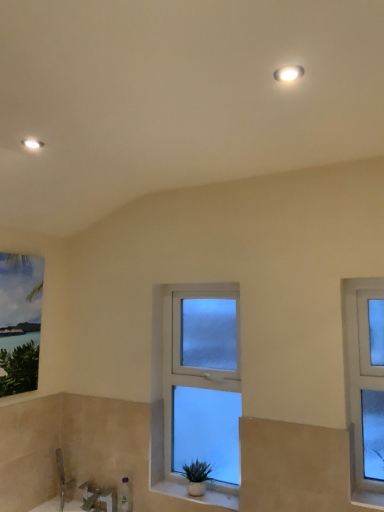
Question: Is matte white recessed light at upper left, which appears as the first light fixture when viewed from the back, looking in the opposite direction of clear glass window at center, arranged as the second window when viewed from the front?

Choices:
 (A) no
 (B) yes

Answer: (A)

Question: Is matte white recessed light at upper left, the 2th light fixture positioned from the top, shorter than clear glass window at center, arranged as the second window when viewed from the front?

Choices:
 (A) yes
 (B) no

Answer: (A)

Question: Is matte white recessed light at upper left, positioned as the second light fixture in right-to-left order, at the left side of clear glass window at center, which is the 1th window in left-to-right order?

Choices:
 (A) no
 (B) yes

Answer: (B)

Question: Is matte white recessed light at upper left, placed as the second light fixture when sorted from front to back, far from clear glass window at center, acting as the first window starting from the back?

Choices:
 (A) yes
 (B) no

Answer: (A)

Question: From the image's perspective, is matte white recessed light at upper left, which is counted as the 1th light fixture, starting from the bottom, beneath clear glass window at center, positioned as the second window in right-to-left order?

Choices:
 (A) no
 (B) yes

Answer: (A)

Question: Can clear glass window at center, arranged as the second window when viewed from the front, be found inside matte white recessed light at upper left, which appears as the first light fixture when viewed from the back?

Choices:
 (A) yes
 (B) no

Answer: (B)

Question: Considering the relative sizes of white glossy light fixture at upper center, the second light fixture when ordered from bottom to top, and matte white recessed light at upper left, arranged as the first light fixture when viewed from the left, in the image provided, is white glossy light fixture at upper center, the second light fixture when ordered from bottom to top, shorter than matte white recessed light at upper left, arranged as the first light fixture when viewed from the left,?

Choices:
 (A) no
 (B) yes

Answer: (B)

Question: Is white glossy light fixture at upper center, the second light fixture when ordered from bottom to top, positioned far away from matte white recessed light at upper left, the 2th light fixture positioned from the top?

Choices:
 (A) yes
 (B) no

Answer: (A)

Question: Is white glossy light fixture at upper center, the 2th light fixture positioned from the left, taller than matte white recessed light at upper left, positioned as the second light fixture in right-to-left order?

Choices:
 (A) no
 (B) yes

Answer: (A)

Question: Is white glossy light fixture at upper center, positioned as the 1th light fixture in top-to-bottom order, further to camera compared to matte white recessed light at upper left, the 2th light fixture positioned from the top?

Choices:
 (A) no
 (B) yes

Answer: (A)

Question: From a real-world perspective, is white glossy light fixture at upper center, the first light fixture when ordered from front to back, beneath matte white recessed light at upper left, the 2th light fixture positioned from the top?

Choices:
 (A) yes
 (B) no

Answer: (B)

Question: Can you confirm if white glossy light fixture at upper center, the 1th light fixture positioned from the right, is bigger than matte white recessed light at upper left, which is counted as the 1th light fixture, starting from the bottom?

Choices:
 (A) no
 (B) yes

Answer: (A)

Question: Can we say white glossy light fixture at upper center, the first light fixture when ordered from front to back, lies outside clear glass window at right, acting as the first window starting from the right?

Choices:
 (A) no
 (B) yes

Answer: (B)